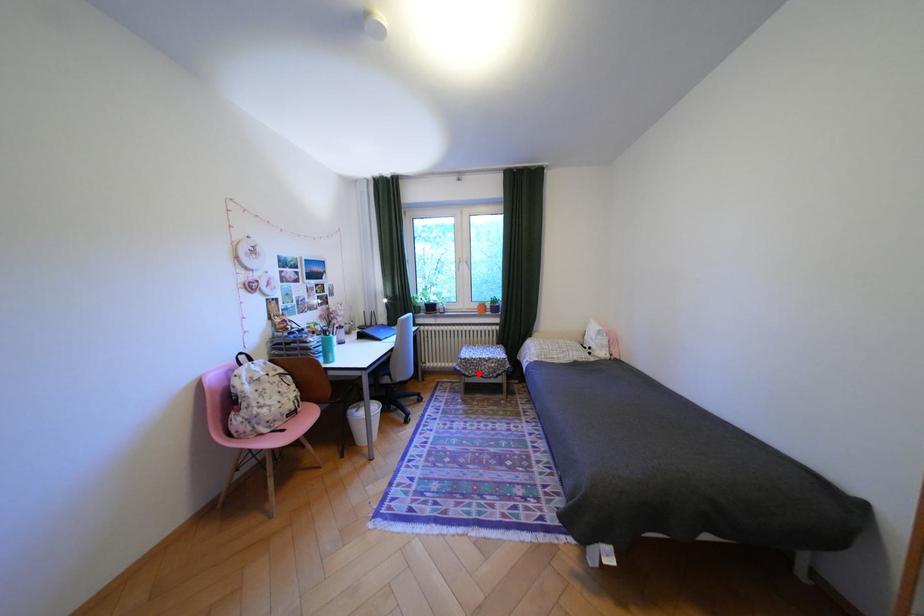
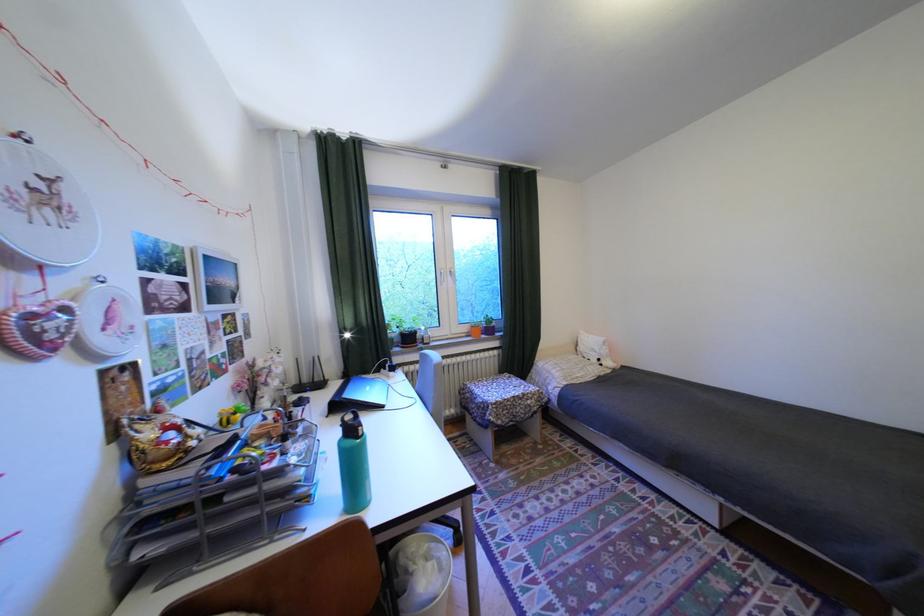
The point at the highlighted location is marked in the first image. Where is the corresponding point in the second image?

(512, 422)